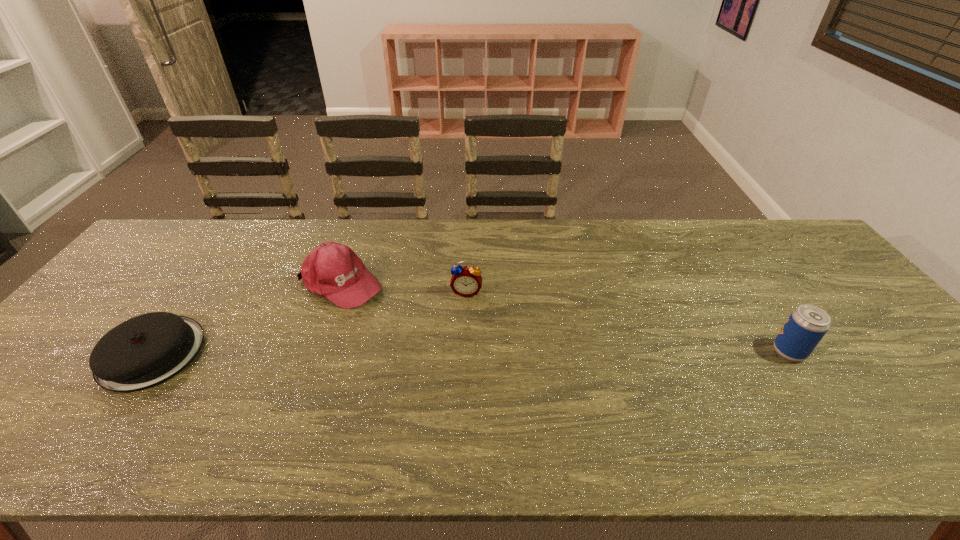
Locate an element on the screen. This screenshot has height=540, width=960. vacant space on the desktop that is between the shortest object and the beer can and is positioned on the front-facing side of the alarm clock is located at coordinates (459, 352).

Find the location of a particular element. The height and width of the screenshot is (540, 960). vacant space on the desktop that is between the pancake and the rightmost object and is positioned at the front of the second object from left to right with the brim is located at coordinates (458, 352).